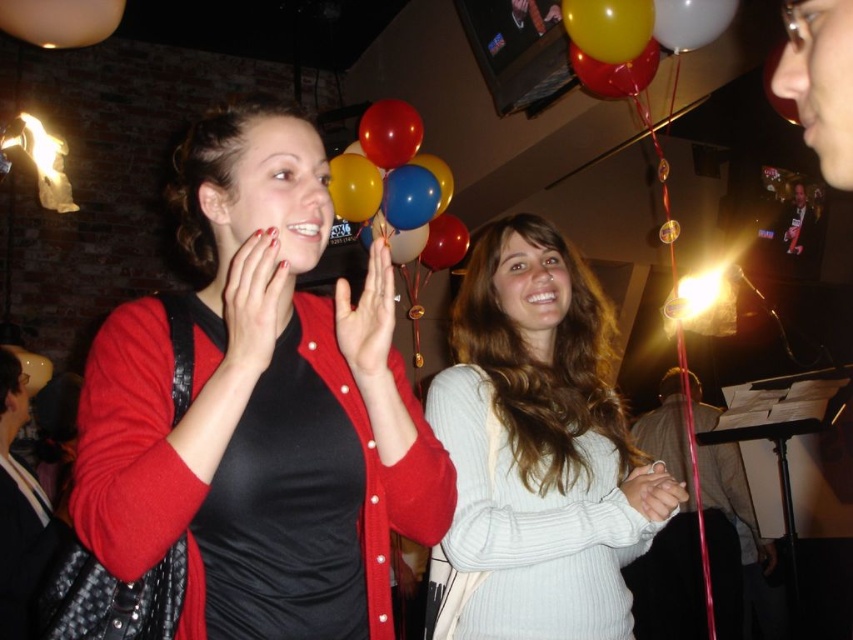
Looking at the scene of two women celebrating at a party, you notice the rubber balloons at center and the white glossy balloon at upper center. Which of these balloons is positioned more to the left side of the image?

The rubber balloons at center are positioned more to the left side of the image compared to the white glossy balloon at upper center.

From the picture: You are at a party and want to grab a balloon. The shiny metallic balloons at upper center and the matte yellow balloon at upper center are both above you. Which one is closer to your left side?

The shiny metallic balloons at upper center are closer to your left side because they are positioned to the left of the matte yellow balloon at upper center.